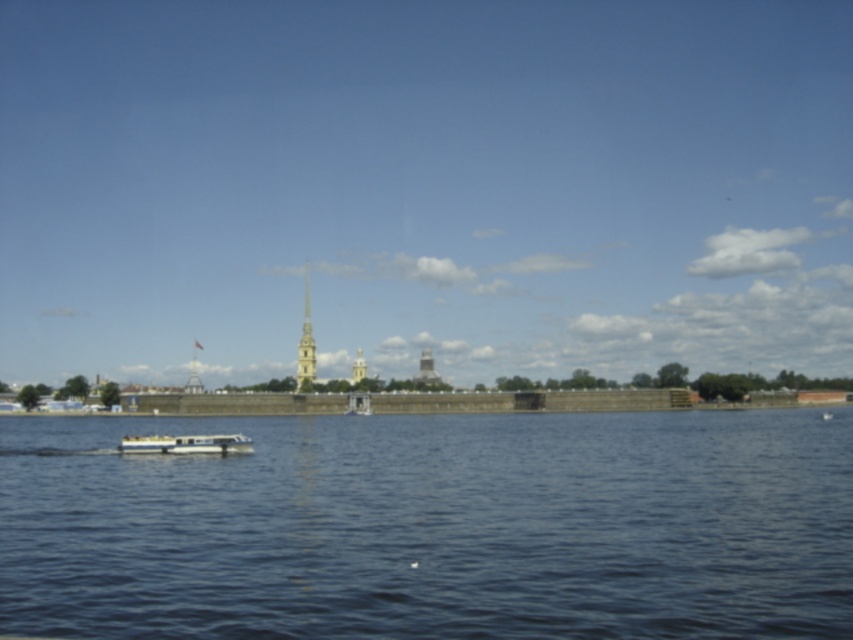
You are standing at the point with coordinates point (309, 340) and want to see the point with coordinates point (171, 435). Can you see it directly without any obstructions?

Point (171, 435) is in front of point (309, 340), so yes, you can see it directly without any obstructions.

You are standing on the riverside and want to take a photo of the white glossy boat at lower left and the blue water at center. Which object should you focus on first if you want to capture both in the same frame without moving the camera?

You should focus on the white glossy boat at lower left first because the blue water at center is positioned under it, meaning the boat is closer to you than the water. By focusing on the closer object, both will be in focus if within the depth of field.